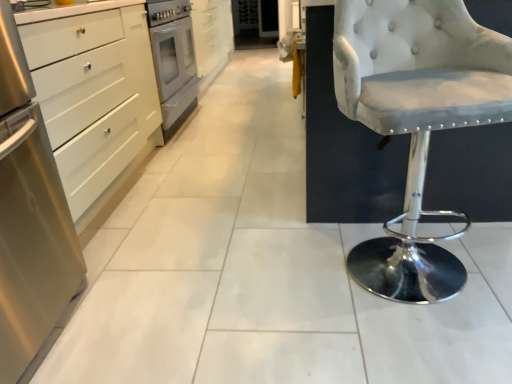
Question: From the image's perspective, is stainless steel oven at center-left positioned above or below stainless steel cabinet at left, which is the second cabinetry in top-to-bottom order?

Choices:
 (A) above
 (B) below

Answer: (A)

Question: From a real-world perspective, is stainless steel oven at center-left physically located above or below stainless steel cabinet at left, which is the first cabinetry from left to right?

Choices:
 (A) above
 (B) below

Answer: (B)

Question: Estimate the real-world distances between objects in this image. Which object is closer to the white tufted fabric stool at right?

Choices:
 (A) stainless steel cabinet at left, which is the second cabinetry in back-to-front order
 (B) stainless steel oven at center-left
 (C) white glossy cabinet at upper left, the 1th cabinetry from the right

Answer: (A)

Question: Considering the real-world distances, which object is closest to the white tufted fabric stool at right?

Choices:
 (A) stainless steel oven at center-left
 (B) white glossy cabinet at upper left, placed as the first cabinetry when sorted from top to bottom
 (C) stainless steel cabinet at left, which is the second cabinetry in back-to-front order

Answer: (C)